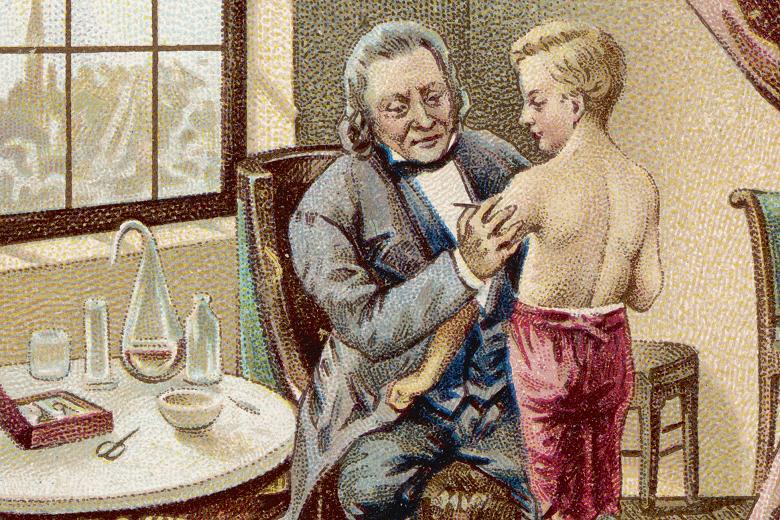
The width and height of the screenshot is (780, 520). In order to click on bowl in this screenshot , I will do `click(174, 402)`.